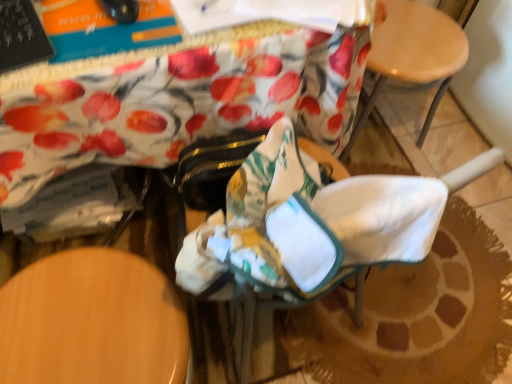
Where is `white fabric rocking chair at center`? This screenshot has width=512, height=384. white fabric rocking chair at center is located at coordinates (409, 309).

The width and height of the screenshot is (512, 384). What do you see at coordinates (409, 309) in the screenshot?
I see `white fabric rocking chair at center` at bounding box center [409, 309].

Measure the distance between white fabric rocking chair at center and camera.

19.21 inches.

Consider the image. Measure the distance between wooden at upper right and camera.

wooden at upper right is 1.11 meters from camera.

Describe the element at coordinates (413, 55) in the screenshot. Image resolution: width=512 pixels, height=384 pixels. I see `wooden at upper right` at that location.

Where is `wooden at upper right`? The image size is (512, 384). wooden at upper right is located at coordinates (413, 55).

This screenshot has height=384, width=512. Identify the location of white fabric rocking chair at center. (409, 309).

Can you confirm if white fabric rocking chair at center is positioned to the right of wooden at upper right?

No.

Considering their positions, is white fabric rocking chair at center located in front of or behind wooden at upper right?

Visually, white fabric rocking chair at center is located in front of wooden at upper right.

Between point (269, 364) and point (364, 114), which one is positioned behind?

Positioned behind is point (364, 114).

From the image's perspective, is white fabric rocking chair at center located beneath wooden at upper right?

Yes, from the image's perspective, white fabric rocking chair at center is below wooden at upper right.

From a real-world perspective, which object rests below the other?

In real-world perspective, wooden at upper right is lower.

Based on the photo, can you confirm if white fabric rocking chair at center is thinner than wooden at upper right?

In fact, white fabric rocking chair at center might be wider than wooden at upper right.

Which of these two, white fabric rocking chair at center or wooden at upper right, stands shorter?

With less height is wooden at upper right.

Does white fabric rocking chair at center have a larger size compared to wooden at upper right?

Indeed, white fabric rocking chair at center has a larger size compared to wooden at upper right.

Is wooden at upper right inside white fabric rocking chair at center?

No.

Can you see white fabric rocking chair at center touching wooden at upper right?

No, white fabric rocking chair at center is not with wooden at upper right.

Is white fabric rocking chair at center positioned with its back to wooden at upper right?

white fabric rocking chair at center is not turned away from wooden at upper right.

How many degrees apart are the facing directions of white fabric rocking chair at center and wooden at upper right?

white fabric rocking chair at center and wooden at upper right are facing 173 degrees away from each other.

How distant is white fabric rocking chair at center from wooden at upper right?

21.90 inches.

Locate an element on the screen. The height and width of the screenshot is (384, 512). rocking chair above the wooden at upper right (from a real-world perspective) is located at coordinates (409, 309).

Is wooden at upper right at the left side of white fabric rocking chair at center?

No, wooden at upper right is not to the left of white fabric rocking chair at center.

Relative to white fabric rocking chair at center, is wooden at upper right in front or behind?

wooden at upper right is positioned farther from the viewer than white fabric rocking chair at center.

Which is nearer, (346, 147) or (344, 355)?

Point (346, 147) appears to be farther away from the viewer than point (344, 355).

From the image's perspective, does wooden at upper right appear higher than white fabric rocking chair at center?

Yes.

From a real-world perspective, is wooden at upper right on white fabric rocking chair at center?

No, from a real-world perspective, wooden at upper right is not above white fabric rocking chair at center.

Considering the sizes of wooden at upper right and white fabric rocking chair at center in the image, is wooden at upper right wider or thinner than white fabric rocking chair at center?

In the image, wooden at upper right appears to be more narrow than white fabric rocking chair at center.

In terms of height, does wooden at upper right look taller or shorter compared to white fabric rocking chair at center?

In the image, wooden at upper right appears to be shorter than white fabric rocking chair at center.

Considering the sizes of wooden at upper right and white fabric rocking chair at center in the image, is wooden at upper right bigger or smaller than white fabric rocking chair at center?

Considering their sizes, wooden at upper right takes up less space than white fabric rocking chair at center.

Does wooden at upper right contain white fabric rocking chair at center?

No, white fabric rocking chair at center is not surrounded by wooden at upper right.

In the scene shown: Is wooden at upper right touching white fabric rocking chair at center?

No, wooden at upper right is not touching white fabric rocking chair at center.

Is wooden at upper right turned away from white fabric rocking chair at center?

No, wooden at upper right is not facing away from white fabric rocking chair at center.

Can you tell me how much wooden at upper right and white fabric rocking chair at center differ in facing direction?

173 degrees separate the facing orientations of wooden at upper right and white fabric rocking chair at center.

Measure the distance from wooden at upper right to white fabric rocking chair at center.

wooden at upper right and white fabric rocking chair at center are 21.90 inches apart.

Where is `chair that appears behind the white fabric rocking chair at center`? Image resolution: width=512 pixels, height=384 pixels. chair that appears behind the white fabric rocking chair at center is located at coordinates (413, 55).

Image resolution: width=512 pixels, height=384 pixels. In order to click on rocking chair below the wooden at upper right (from the image's perspective) in this screenshot , I will do `click(409, 309)`.

This screenshot has height=384, width=512. I want to click on rocking chair above the wooden at upper right (from a real-world perspective), so click(409, 309).